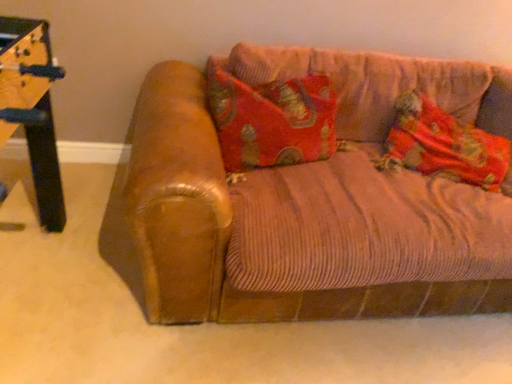
Where is `brown leather couch at center`? The height and width of the screenshot is (384, 512). brown leather couch at center is located at coordinates (307, 204).

Describe the element at coordinates (307, 204) in the screenshot. This screenshot has height=384, width=512. I see `brown leather couch at center` at that location.

Describe the element at coordinates (443, 145) in the screenshot. This screenshot has width=512, height=384. I see `velvet-like fabric pillow at right` at that location.

The width and height of the screenshot is (512, 384). In order to click on velvet-like fabric pillow at right in this screenshot , I will do click(443, 145).

At what (x,y) coordinates should I click in order to perform the action: click on brown leather couch at center. Please return your answer as a coordinate pair (x, y). The width and height of the screenshot is (512, 384). Looking at the image, I should click on (307, 204).

Is brown leather couch at center at the right side of velvet-like fabric pillow at right?

In fact, brown leather couch at center is to the left of velvet-like fabric pillow at right.

Considering the relative positions of brown leather couch at center and velvet-like fabric pillow at right in the image provided, is brown leather couch at center in front of velvet-like fabric pillow at right?

Yes, the depth of brown leather couch at center is less than that of velvet-like fabric pillow at right.

Is point (353, 159) closer or farther from the camera than point (496, 142)?

Clearly, point (353, 159) is closer to the camera than point (496, 142).

Looking at this image, from the image's perspective, between brown leather couch at center and velvet-like fabric pillow at right, who is located below?

brown leather couch at center.

From a real-world perspective, does brown leather couch at center stand above velvet-like fabric pillow at right?

No.

Which of these two, brown leather couch at center or velvet-like fabric pillow at right, is wider?

With larger width is brown leather couch at center.

Between brown leather couch at center and velvet-like fabric pillow at right, which one has more height?

With more height is brown leather couch at center.

In terms of size, does brown leather couch at center appear bigger or smaller than velvet-like fabric pillow at right?

In the image, brown leather couch at center appears to be larger than velvet-like fabric pillow at right.

Would you say velvet-like fabric pillow at right is part of brown leather couch at center's contents?

Yes, brown leather couch at center contains velvet-like fabric pillow at right.

Does brown leather couch at center touch velvet-like fabric pillow at right?

No, brown leather couch at center is not with velvet-like fabric pillow at right.

Is velvet-like fabric pillow at right at the back of brown leather couch at center?

That's right, brown leather couch at center is facing away from velvet-like fabric pillow at right.

How many degrees apart are the facing directions of brown leather couch at center and velvet-like fabric pillow at right?

They differ by 8.31 degrees in their facing directions.

Locate an element on the screen. The width and height of the screenshot is (512, 384). studio couch located underneath the velvet-like fabric pillow at right (from a real-world perspective) is located at coordinates (307, 204).

Is velvet-like fabric pillow at right at the right side of brown leather couch at center?

Indeed, velvet-like fabric pillow at right is positioned on the right side of brown leather couch at center.

Considering their positions, is velvet-like fabric pillow at right located in front of or behind brown leather couch at center?

Clearly, velvet-like fabric pillow at right is behind brown leather couch at center.

Considering the positions of point (393, 164) and point (489, 130), is point (393, 164) closer or farther from the camera than point (489, 130)?

Point (393, 164).

From the image's perspective, between velvet-like fabric pillow at right and brown leather couch at center, which one is located above?

velvet-like fabric pillow at right, from the image's perspective.

Consider the image. From a real-world perspective, is velvet-like fabric pillow at right positioned above or below brown leather couch at center?

velvet-like fabric pillow at right is situated higher than brown leather couch at center in the real world.

Does velvet-like fabric pillow at right have a lesser width compared to brown leather couch at center?

Yes, velvet-like fabric pillow at right is thinner than brown leather couch at center.

Who is shorter, velvet-like fabric pillow at right or brown leather couch at center?

Standing shorter between the two is velvet-like fabric pillow at right.

In the scene shown: Which of these two, velvet-like fabric pillow at right or brown leather couch at center, is bigger?

Bigger between the two is brown leather couch at center.

Is brown leather couch at center a part of velvet-like fabric pillow at right?

No, brown leather couch at center is not inside velvet-like fabric pillow at right.

Based on the photo, is velvet-like fabric pillow at right beside brown leather couch at center?

No, velvet-like fabric pillow at right is not touching brown leather couch at center.

Is velvet-like fabric pillow at right looking in the opposite direction of brown leather couch at center?

Yes.

How different are the orientations of velvet-like fabric pillow at right and brown leather couch at center in degrees?

8.31 degrees.

Measure the distance from velvet-like fabric pillow at right to brown leather couch at center.

They are 14.33 inches apart.

I want to click on material behind the brown leather couch at center, so click(x=443, y=145).

In the image, there is a velvet-like fabric pillow at right. Where is `studio couch below it (from the image's perspective)`? Image resolution: width=512 pixels, height=384 pixels. studio couch below it (from the image's perspective) is located at coordinates (307, 204).

Identify the location of material behind the brown leather couch at center. The width and height of the screenshot is (512, 384). (443, 145).